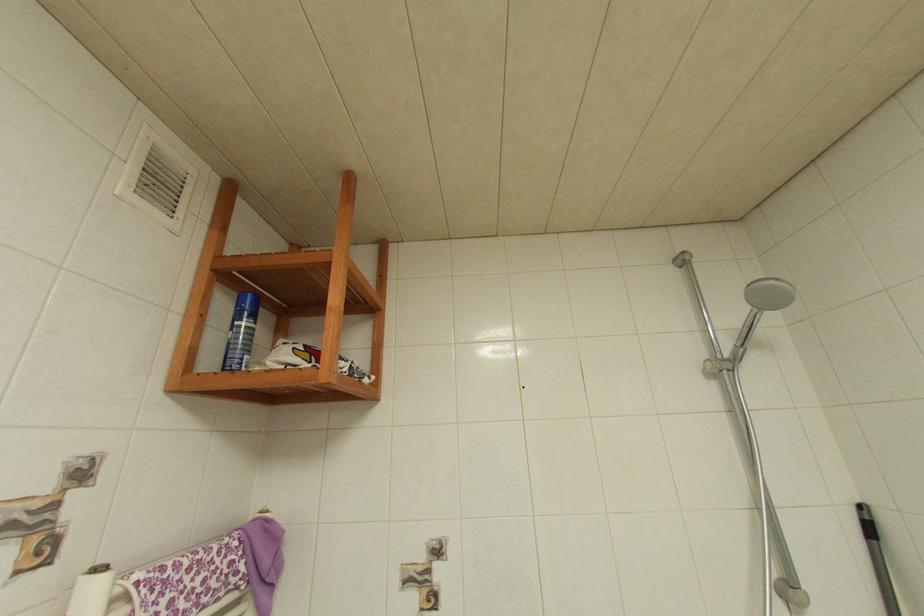
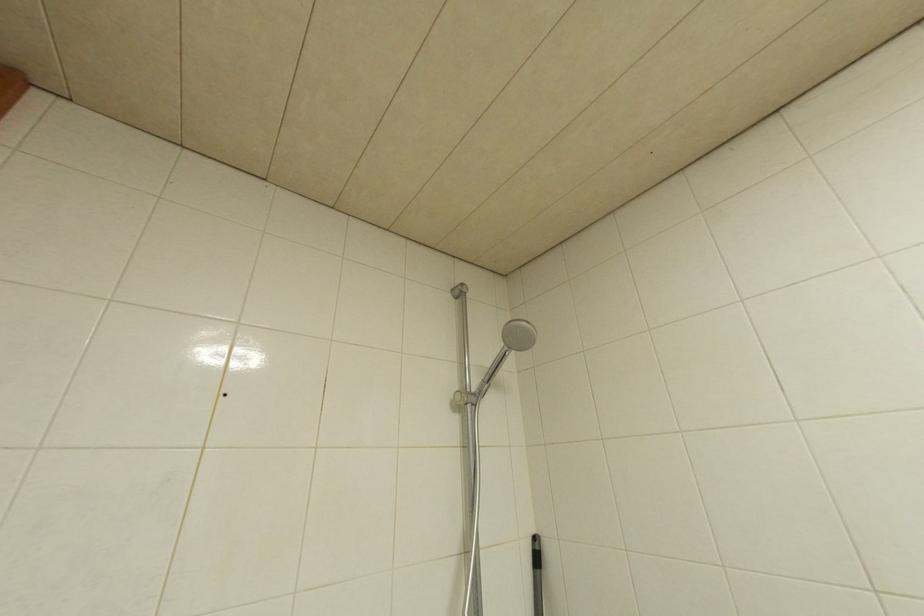
Question: The camera is either moving clockwise (left) or counter-clockwise (right) around the object. The first image is from the beginning of the video and the second image is from the end. Is the camera moving left or right when shooting the video?

Choices:
 (A) Left
 (B) Right

Answer: (A)